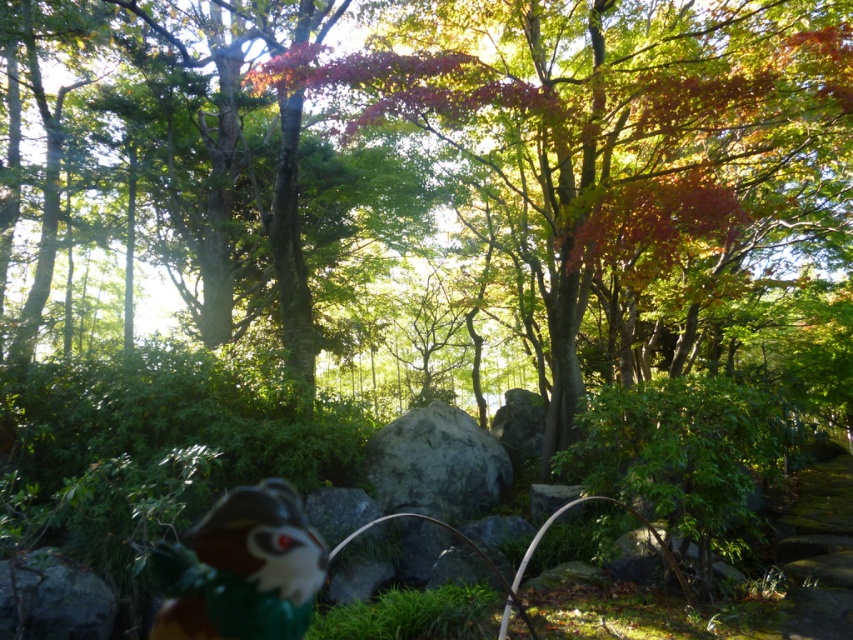
You are a hiker who has just entered the forest and see the brown matte plush toy at lower left and the gray rough rock at center. Which object is closer to your left side?

The brown matte plush toy at lower left is closer to your left side because it is positioned to the left of the gray rough rock at center.

You are a hiker who wants to place a small flag exactly halfway between the green leafy tree at center and the brown matte plush toy at lower left. Given their height difference, will the flag be closer to the tree or the toy?

The green leafy tree at center is taller than the brown matte plush toy at lower left. Since the flag is placed halfway between them horizontally, the vertical distance doesn

You are a hiker who wants to take a photo of the green leafy tree at center and the brown matte plush toy at lower left. Which object should you zoom in on to capture more details in your photo?

The green leafy tree at center is bigger than the brown matte plush toy at lower left, so you should zoom in on the brown matte plush toy at lower left to capture more details since it is smaller and requires closer focus for clarity.